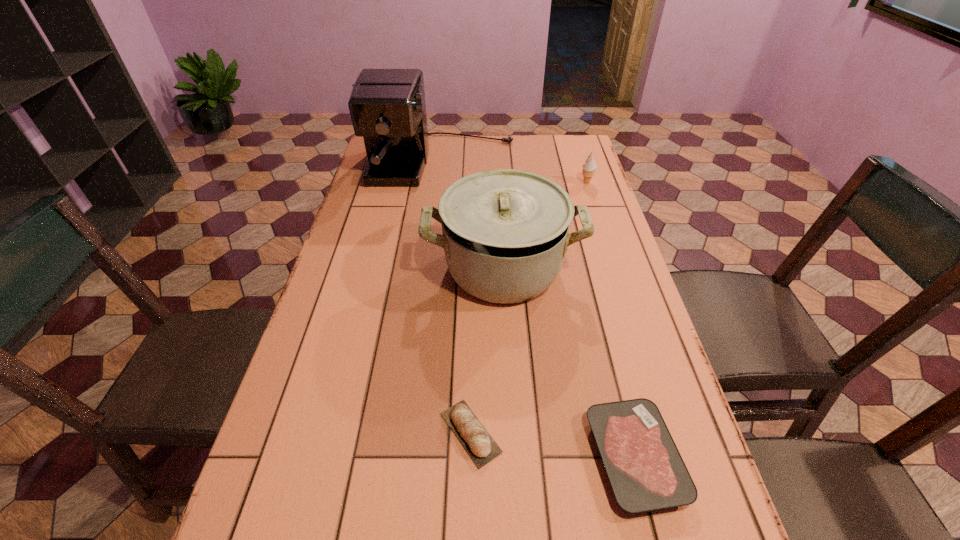
Find the location of `the tallest object`. the tallest object is located at coordinates (387, 107).

This screenshot has height=540, width=960. Identify the location of the second tallest object. (505, 232).

Image resolution: width=960 pixels, height=540 pixels. Find the location of `saucepan`. saucepan is located at coordinates [x=505, y=232].

What are the coordinates of `the third shortest object` in the screenshot? It's located at (589, 167).

This screenshot has width=960, height=540. I want to click on the second shortest object, so click(x=481, y=447).

I want to click on steak, so click(x=646, y=471).

In order to click on free point located 0.350m on the front-facing side of the tallest object in this screenshot , I will do `click(428, 275)`.

This screenshot has width=960, height=540. I want to click on vacant region located on the right of the saucepan, so click(607, 268).

At what (x,y) coordinates should I click in order to perform the action: click on vacant region located 0.060m on the front-facing side of the third tallest object. Please return your answer as a coordinate pair (x, y). The width and height of the screenshot is (960, 540). Looking at the image, I should click on click(x=591, y=196).

You are a GUI agent. You are given a task and a screenshot of the screen. Output one action in this format:
    pyautogui.click(x=<x>, y=<y>)
    Task: Click on the vacant space located on the right of the pita bread
    The height and width of the screenshot is (540, 960).
    Given the screenshot: What is the action you would take?
    pyautogui.click(x=560, y=433)